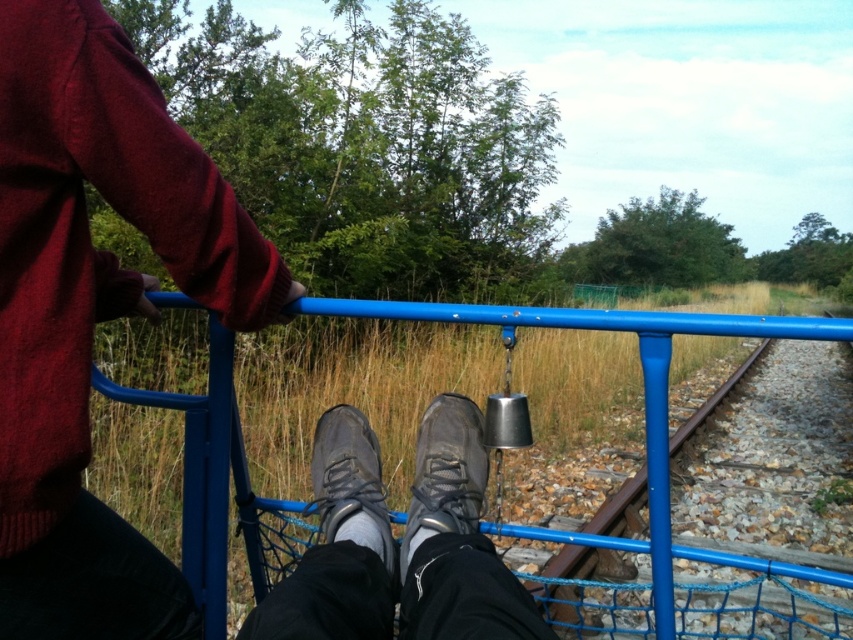
Is blue metallic rail at center below dark gray fabric shoe at center?

Yes, blue metallic rail at center is below dark gray fabric shoe at center.

Who is lower down, blue metallic rail at center or dark gray fabric shoe at center?

blue metallic rail at center is lower down.

Between point (653, 397) and point (355, 429), which one is positioned in front?

Point (653, 397) is in front.

Locate an element on the screen. blue metallic rail at center is located at coordinates (643, 401).

You are a GUI agent. You are given a task and a screenshot of the screen. Output one action in this format:
    pyautogui.click(x=<x>, y=<y>)
    Task: Click on the maroon sweater at upper left
    This screenshot has height=640, width=853.
    Given the screenshot: What is the action you would take?
    pyautogui.click(x=94, y=308)

Does maroon sweater at upper left come in front of dark gray fabric shoe at center?

Yes, maroon sweater at upper left is closer to the viewer.

Where is `maroon sweater at upper left`? The image size is (853, 640). maroon sweater at upper left is located at coordinates (94, 308).

Is dark grey leather shoe at center positioned at the back of dark gray fabric shoe at center?

Yes.

Does dark grey leather shoe at center appear on the right side of dark gray fabric shoe at center?

Yes, dark grey leather shoe at center is to the right of dark gray fabric shoe at center.

Between point (454, 472) and point (386, 525), which one is positioned in front?

Point (386, 525)

Where is `dark grey leather shoe at center`? The height and width of the screenshot is (640, 853). dark grey leather shoe at center is located at coordinates (445, 472).